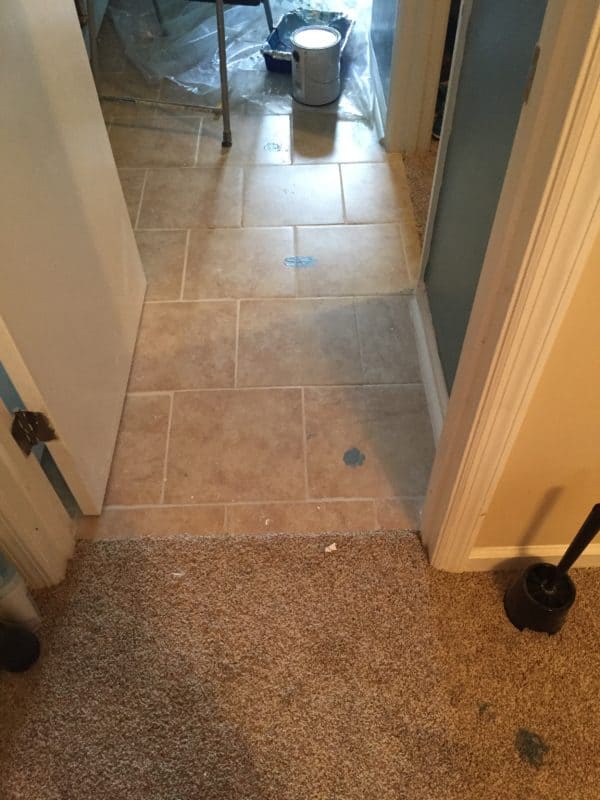
Image resolution: width=600 pixels, height=800 pixels. In order to click on plastic clear cover for floor in this screenshot , I will do `click(245, 76)`.